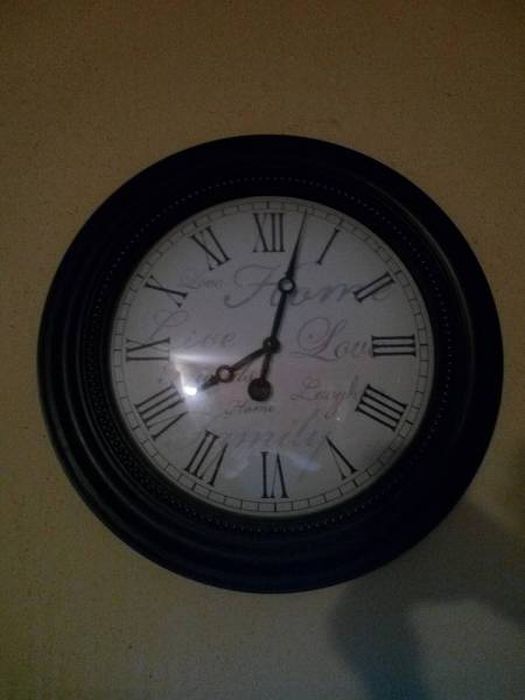
Locate an element on the screen. wall is located at coordinates (166, 623).